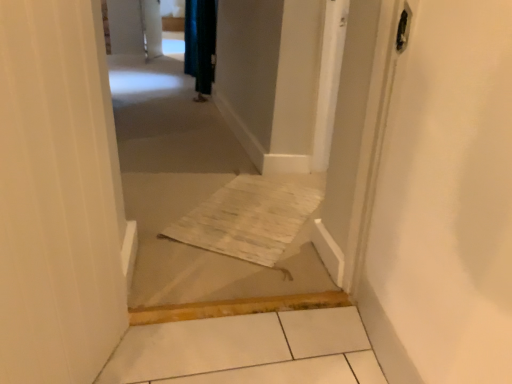
The height and width of the screenshot is (384, 512). I want to click on neutral carpet at center, so click(x=193, y=203).

The width and height of the screenshot is (512, 384). Describe the element at coordinates (193, 203) in the screenshot. I see `neutral carpet at center` at that location.

Identify the location of velvet dark green curtain at upper center. (200, 43).

The height and width of the screenshot is (384, 512). What do you see at coordinates (200, 43) in the screenshot? I see `velvet dark green curtain at upper center` at bounding box center [200, 43].

This screenshot has height=384, width=512. I want to click on neutral carpet at center, so click(x=193, y=203).

Can you confirm if velvet dark green curtain at upper center is positioned to the left of neutral carpet at center?

Correct, you'll find velvet dark green curtain at upper center to the left of neutral carpet at center.

From the picture: Considering the positions of objects velvet dark green curtain at upper center and neutral carpet at center in the image provided, who is behind, velvet dark green curtain at upper center or neutral carpet at center?

velvet dark green curtain at upper center is further away from the camera.

Which is nearer, (204, 81) or (143, 192)?

The point (143, 192) is more forward.

From the image's perspective, is velvet dark green curtain at upper center over neutral carpet at center?

Correct, velvet dark green curtain at upper center appears higher than neutral carpet at center in the image.

From a real-world perspective, is velvet dark green curtain at upper center above or below neutral carpet at center?

velvet dark green curtain at upper center is situated higher than neutral carpet at center in the real world.

Looking at their sizes, would you say velvet dark green curtain at upper center is wider or thinner than neutral carpet at center?

In the image, velvet dark green curtain at upper center appears to be more narrow than neutral carpet at center.

Is velvet dark green curtain at upper center shorter than neutral carpet at center?

Incorrect, the height of velvet dark green curtain at upper center does not fall short of that of neutral carpet at center.

Who is smaller, velvet dark green curtain at upper center or neutral carpet at center?

velvet dark green curtain at upper center.

Which is correct: velvet dark green curtain at upper center is inside neutral carpet at center, or outside of it?

velvet dark green curtain at upper center is not enclosed by neutral carpet at center.

Are velvet dark green curtain at upper center and neutral carpet at center beside each other?

No, velvet dark green curtain at upper center is not making contact with neutral carpet at center.

Is velvet dark green curtain at upper center oriented away from neutral carpet at center?

velvet dark green curtain at upper center is not turned away from neutral carpet at center.

Locate an element on the screen. The image size is (512, 384). corridor that is on the right side of velvet dark green curtain at upper center is located at coordinates (193, 203).

Can you confirm if neutral carpet at center is positioned to the left of velvet dark green curtain at upper center?

No.

In the scene shown: Which object is further away from the camera taking this photo, neutral carpet at center or velvet dark green curtain at upper center?

Positioned behind is velvet dark green curtain at upper center.

Which is farther from the camera, [163,164] or [203,67]?

The point [203,67] is behind.

From the image's perspective, would you say neutral carpet at center is shown under velvet dark green curtain at upper center?

Indeed, from the image's perspective, neutral carpet at center is shown beneath velvet dark green curtain at upper center.

From a real-world perspective, who is located higher, neutral carpet at center or velvet dark green curtain at upper center?

In real-world perspective, velvet dark green curtain at upper center is above.

Looking at their sizes, would you say neutral carpet at center is wider or thinner than velvet dark green curtain at upper center?

neutral carpet at center is wider than velvet dark green curtain at upper center.

Considering the sizes of neutral carpet at center and velvet dark green curtain at upper center in the image, is neutral carpet at center taller or shorter than velvet dark green curtain at upper center?

Clearly, neutral carpet at center is shorter compared to velvet dark green curtain at upper center.

Who is bigger, neutral carpet at center or velvet dark green curtain at upper center?

Bigger between the two is neutral carpet at center.

Does neutral carpet at center contain velvet dark green curtain at upper center?

That's incorrect, velvet dark green curtain at upper center is not inside neutral carpet at center.

Is neutral carpet at center with velvet dark green curtain at upper center?

No, neutral carpet at center is not touching velvet dark green curtain at upper center.

Does neutral carpet at center turn towards velvet dark green curtain at upper center?

No, neutral carpet at center is not oriented towards velvet dark green curtain at upper center.

How many degrees apart are the facing directions of neutral carpet at center and velvet dark green curtain at upper center?

The angular difference between neutral carpet at center and velvet dark green curtain at upper center is 92.5 degrees.

Locate an element on the screen. The width and height of the screenshot is (512, 384). corridor to the right of velvet dark green curtain at upper center is located at coordinates (193, 203).

Locate an element on the screen. The image size is (512, 384). corridor that appears in front of the velvet dark green curtain at upper center is located at coordinates (193, 203).

Where is `curtain behind the neutral carpet at center`? The image size is (512, 384). curtain behind the neutral carpet at center is located at coordinates (200, 43).